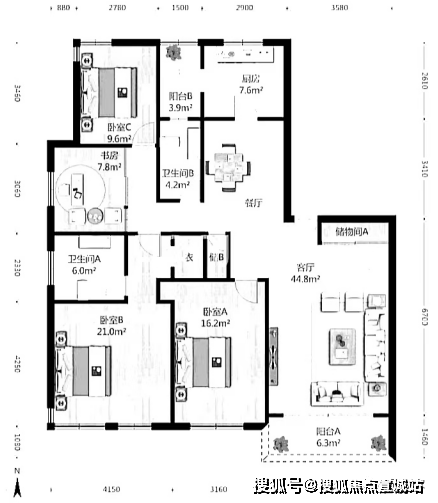
Locate an element on the screen. Image resolution: width=438 pixels, height=503 pixels. bed is located at coordinates (209, 369), (92, 369), (116, 102).